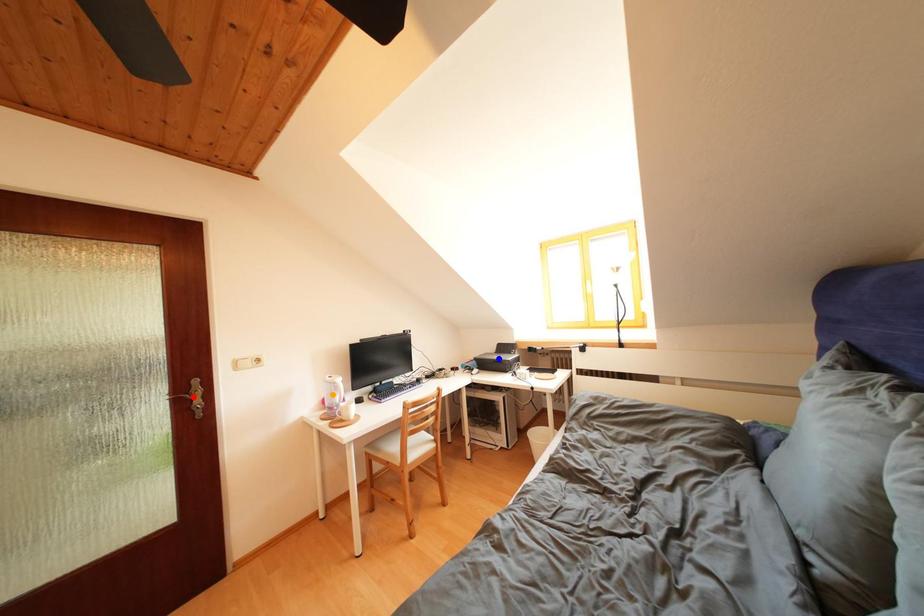
Order these from farthest to nearest:
red point | orange point | blue point

blue point → orange point → red point